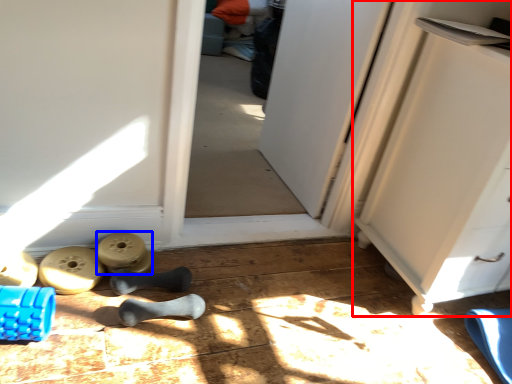
Question: Which point is closer to the camera, cabinetry (highlighted by a red box) or job (highlighted by a blue box)?

Choices:
 (A) cabinetry
 (B) job

Answer: (A)